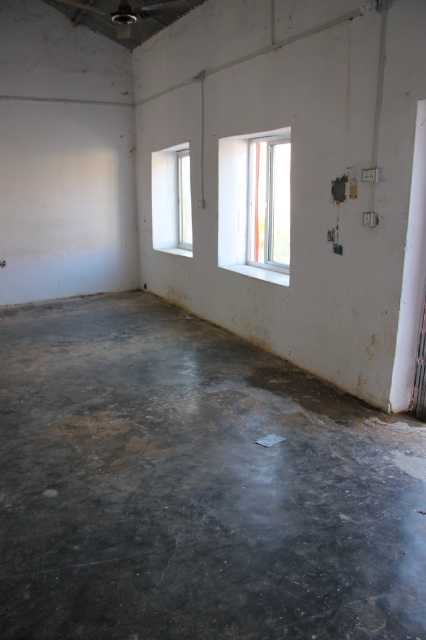
Question: Which point is closer to the camera?

Choices:
 (A) (250, 150)
 (B) (181, 177)

Answer: (A)

Question: Estimate the real-world distances between objects in this image. Which object is farther from the gray concrete floor at center?

Choices:
 (A) white plastic window at center
 (B) white glass window at upper left

Answer: (B)

Question: Which point is closer to the camera?

Choices:
 (A) (247, 195)
 (B) (218, 486)
 (C) (160, 177)

Answer: (B)

Question: In this image, where is gray concrete floor at center located relative to white plastic window at center?

Choices:
 (A) left
 (B) right

Answer: (A)

Question: Can you confirm if white plastic window at center is thinner than white glass window at upper left?

Choices:
 (A) no
 (B) yes

Answer: (A)

Question: Is gray concrete floor at center positioned before white plastic window at center?

Choices:
 (A) yes
 (B) no

Answer: (A)